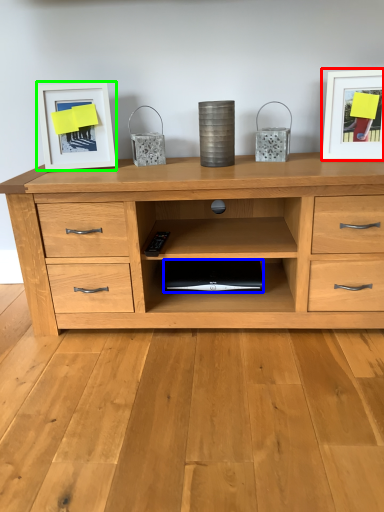
Question: Which is nearer to the picture frame (highlighted by a red box)? computer (highlighted by a blue box) or picture frame (highlighted by a green box).

Choices:
 (A) computer
 (B) picture frame

Answer: (A)